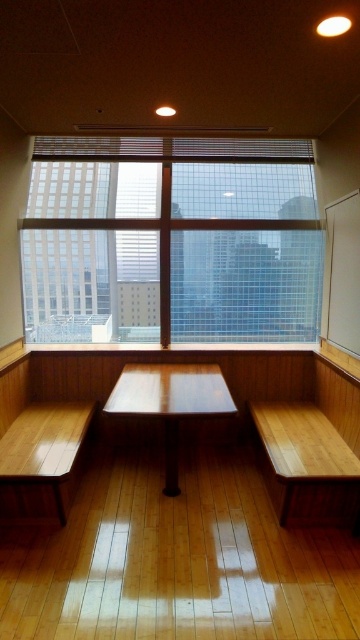
Question: Based on their relative distances, which object is farther from the light brown wood bench at left?

Choices:
 (A) wooden picnic table at center
 (B) clear glass window at upper center

Answer: (B)

Question: Estimate the real-world distances between objects in this image. Which object is farther from the wooden picnic table at center?

Choices:
 (A) clear glass window at upper center
 (B) wooden bench at right

Answer: (A)

Question: Considering the relative positions of light brown wood bench at left and wooden picnic table at center in the image provided, where is light brown wood bench at left located with respect to wooden picnic table at center?

Choices:
 (A) above
 (B) below

Answer: (B)

Question: Does clear glass window at upper center come in front of wooden bench at right?

Choices:
 (A) yes
 (B) no

Answer: (B)

Question: Which point is farther to the camera?

Choices:
 (A) click(83, 413)
 (B) click(307, 330)
 (C) click(351, 442)

Answer: (B)

Question: Does wooden bench at right appear under light brown wood bench at left?

Choices:
 (A) no
 (B) yes

Answer: (A)